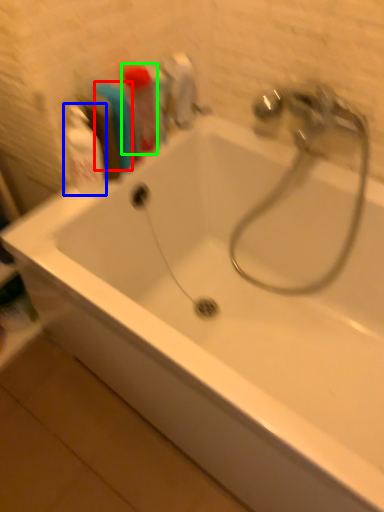
Question: Which object is positioned farthest from toiletry (highlighted by a red box)? Select from cleaning product (highlighted by a blue box) and toiletry (highlighted by a green box).

Choices:
 (A) cleaning product
 (B) toiletry

Answer: (A)